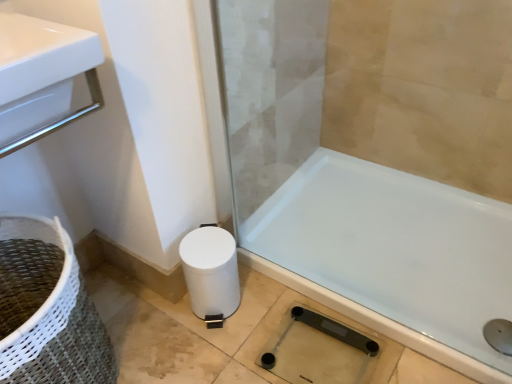
At what (x,y) coordinates should I click in order to perform the action: click on vacant space to the left of transparent glass shower at lower right. Please return your answer as a coordinate pair (x, y). The height and width of the screenshot is (384, 512). Looking at the image, I should click on coord(233,350).